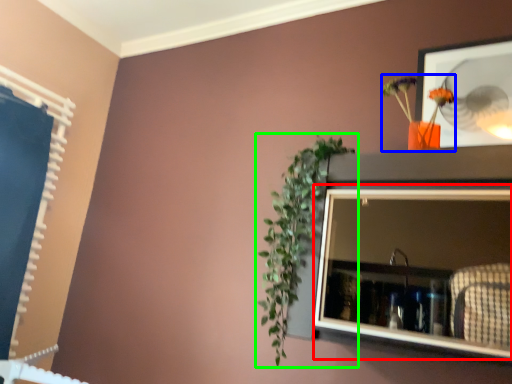
Question: Based on their relative distances, which object is nearer to medicine cabinet (highlighted by a red box)? Choose from floral arrangement (highlighted by a blue box) and houseplant (highlighted by a green box).

Choices:
 (A) floral arrangement
 (B) houseplant

Answer: (B)